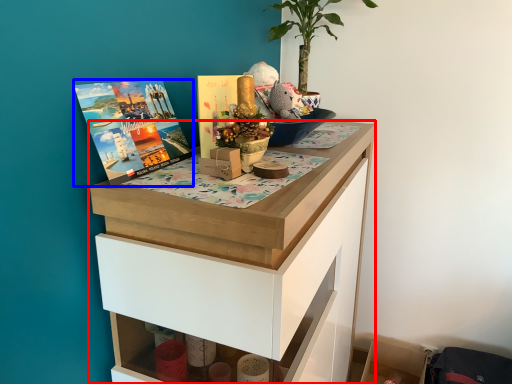
Question: Which object is further to the camera taking this photo, chest of drawers (highlighted by a red box) or book cover (highlighted by a blue box)?

Choices:
 (A) chest of drawers
 (B) book cover

Answer: (B)